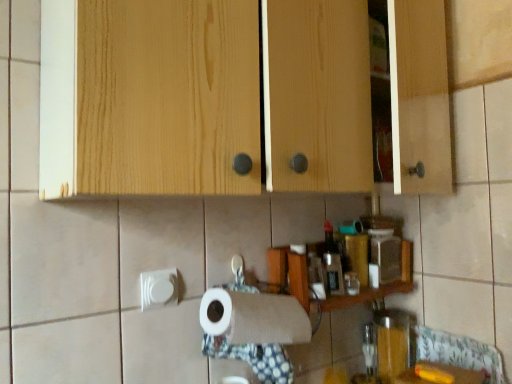
Question: Does wooden shelf at center have a lesser height compared to smooth wooden counter at lower right?

Choices:
 (A) yes
 (B) no

Answer: (A)

Question: Does wooden shelf at center have a lesser width compared to smooth wooden counter at lower right?

Choices:
 (A) no
 (B) yes

Answer: (B)

Question: Can you confirm if wooden shelf at center is positioned to the left of smooth wooden counter at lower right?

Choices:
 (A) yes
 (B) no

Answer: (A)

Question: From a real-world perspective, is wooden shelf at center physically below smooth wooden counter at lower right?

Choices:
 (A) yes
 (B) no

Answer: (B)

Question: Considering the relative sizes of wooden shelf at center and smooth wooden counter at lower right in the image provided, is wooden shelf at center smaller than smooth wooden counter at lower right?

Choices:
 (A) yes
 (B) no

Answer: (B)

Question: Is smooth wooden counter at lower right situated inside wooden shelf at center or outside?

Choices:
 (A) inside
 (B) outside

Answer: (B)

Question: From a real-world perspective, is smooth wooden counter at lower right above or below wooden shelf at center?

Choices:
 (A) below
 (B) above

Answer: (A)

Question: Is point (437, 380) positioned closer to the camera than point (407, 273)?

Choices:
 (A) closer
 (B) farther

Answer: (A)

Question: From the image's perspective, is smooth wooden counter at lower right above or below wooden shelf at center?

Choices:
 (A) above
 (B) below

Answer: (B)

Question: Is point (401, 359) closer or farther from the camera than point (423, 375)?

Choices:
 (A) farther
 (B) closer

Answer: (A)

Question: From a real-world perspective, relative to smooth wooden counter at lower right, is translucent glass jar at lower right vertically above or below?

Choices:
 (A) below
 (B) above

Answer: (B)

Question: Is translucent glass jar at lower right in front of or behind smooth wooden counter at lower right in the image?

Choices:
 (A) front
 (B) behind

Answer: (B)

Question: Considering the positions of translucent glass jar at lower right and smooth wooden counter at lower right in the image, is translucent glass jar at lower right wider or thinner than smooth wooden counter at lower right?

Choices:
 (A) wide
 (B) thin

Answer: (B)

Question: From the image's perspective, is smooth wooden counter at lower right located above or below natural wood cabinet at upper center?

Choices:
 (A) below
 (B) above

Answer: (A)

Question: Relative to natural wood cabinet at upper center, is smooth wooden counter at lower right in front or behind?

Choices:
 (A) front
 (B) behind

Answer: (B)